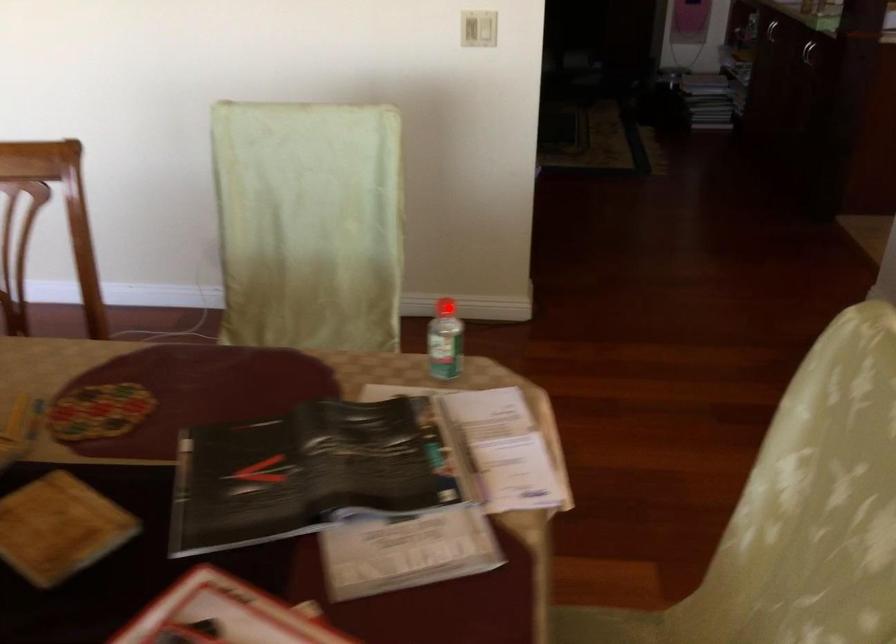
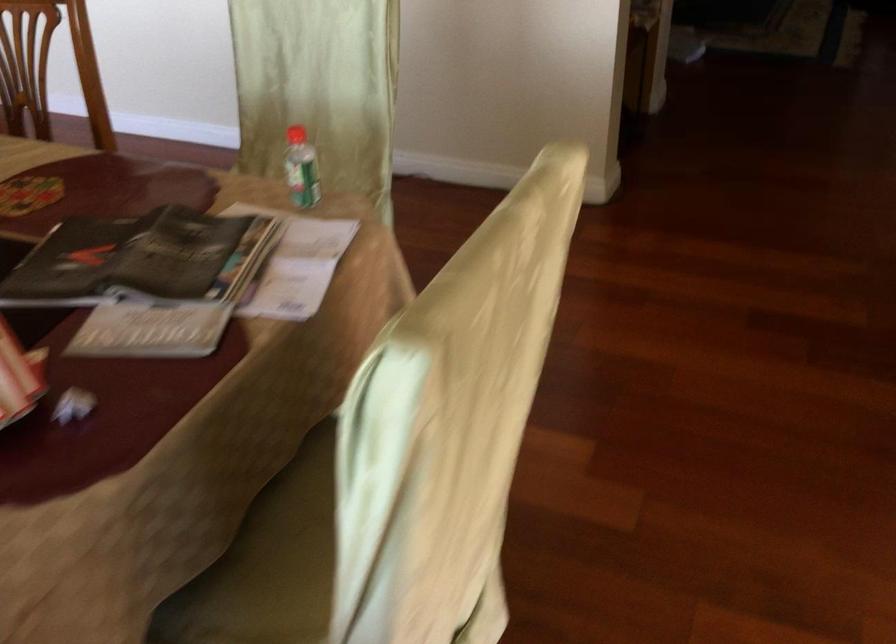
In the second image, find the point that corresponds to the highlighted location in the first image.

(296, 135)